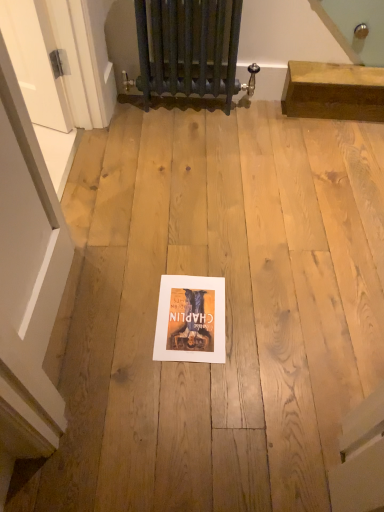
At what (x,y) coordinates should I click in order to perform the action: click on free point above matte paper postcard at center (from a real-world perspective). Please return your answer as a coordinate pair (x, y). Image resolution: width=384 pixels, height=512 pixels. Looking at the image, I should click on (189, 307).